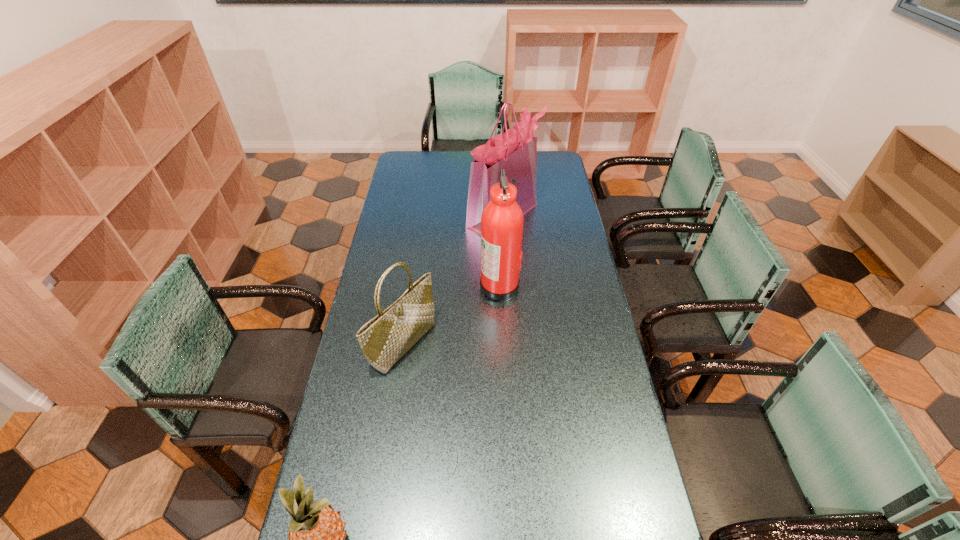
You are a GUI agent. You are given a task and a screenshot of the screen. Output one action in this format:
    pyautogui.click(x=<x>, y=<y>)
    Task: Click on the object present at the left edge
    
    Given the screenshot: What is the action you would take?
    pyautogui.click(x=384, y=339)

Where is `vacant space at the far edge of the desktop`? vacant space at the far edge of the desktop is located at coordinates (451, 174).

The image size is (960, 540). Identify the location of free space at the left edge of the desktop. (342, 480).

In the image, there is a desktop. Where is `vacant area at the right edge`? vacant area at the right edge is located at coordinates (566, 284).

Where is `blank space at the far right corner`? This screenshot has width=960, height=540. blank space at the far right corner is located at coordinates (540, 151).

Where is `blank region between the farther shopping bag and the second nearest object`? This screenshot has width=960, height=540. blank region between the farther shopping bag and the second nearest object is located at coordinates (453, 280).

This screenshot has height=540, width=960. Find the location of `free space that is in between the nearer shopping bag and the farthest object`. free space that is in between the nearer shopping bag and the farthest object is located at coordinates (453, 280).

In order to click on free space between the fire extinguisher and the left shopping bag in this screenshot , I will do `click(452, 314)`.

Locate an element on the screen. object that ranks as the closest to the nearer shopping bag is located at coordinates (502, 219).

Locate which object is the third closest to the left shopping bag. Please provide its 2D coordinates. Your answer should be formatted as a tuple, i.e. [(x, y)], where the tuple contains the x and y coordinates of a point satisfying the conditions above.

[(515, 151)]